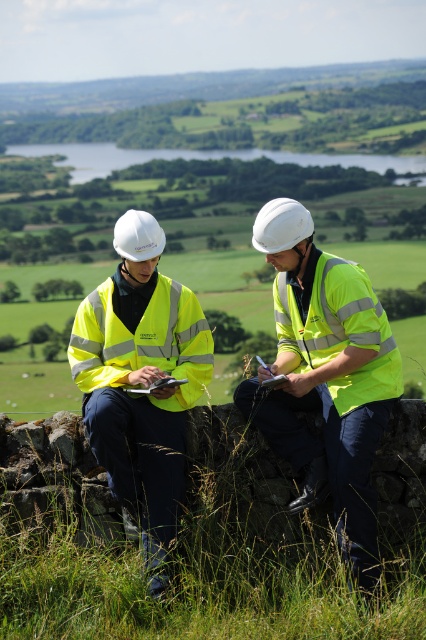
Question: Which object is positioned farthest from the high-visibility yellow vest at center?

Choices:
 (A) high-visibility fabric safety vest at center
 (B) yellow reflective vest at center

Answer: (A)

Question: Which of the following is the farthest from the observer?

Choices:
 (A) (344, 410)
 (B) (327, 304)
 (C) (172, 444)

Answer: (C)

Question: Which point appears closest to the camera in this image?

Choices:
 (A) (198, 316)
 (B) (284, 426)
 (C) (91, 410)
 (D) (376, 548)

Answer: (C)

Question: Is high-visibility yellow vest at center thinner than high-visibility fabric safety vest at right?

Choices:
 (A) no
 (B) yes

Answer: (A)

Question: Can you confirm if yellow reflective vest at left is positioned above high-visibility fabric safety vest at right?

Choices:
 (A) yes
 (B) no

Answer: (B)

Question: Is yellow reflective vest at left wider than high-visibility fabric safety vest at right?

Choices:
 (A) yes
 (B) no

Answer: (A)